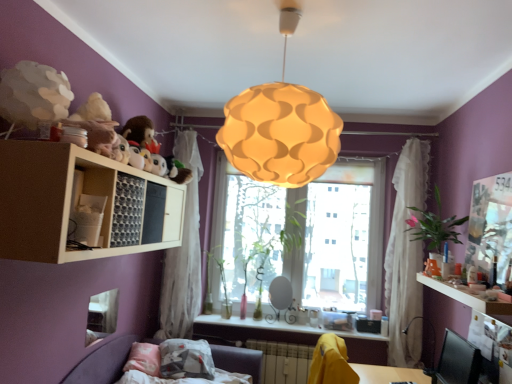
Measure the distance between green glass vase at window, the third plant when ordered from left to right, and camera.

The depth of green glass vase at window, the third plant when ordered from left to right, is 3.49 meters.

What do you see at coordinates (466, 297) in the screenshot? The height and width of the screenshot is (384, 512). I see `matte purple counter top at right, the 2th counter top when ordered from back to front` at bounding box center [466, 297].

Describe the element at coordinates (432, 344) in the screenshot. I see `metallic silver table lamp at lower right` at that location.

Describe the element at coordinates (331, 362) in the screenshot. The height and width of the screenshot is (384, 512). I see `yellow fabric swivel chair at lower center` at that location.

What do you see at coordinates (183, 253) in the screenshot? I see `white sheer curtain at left, placed as the 1th curtain when sorted from left to right` at bounding box center [183, 253].

The width and height of the screenshot is (512, 384). I want to click on matte orange lampshade at center, so click(281, 126).

Identify the location of green glass vase at window, which is counted as the second plant, starting from the right. This screenshot has width=512, height=384. (293, 240).

Could you measure the distance between white sheer curtain at right, placed as the 2th curtain when sorted from left to right, and yellow fabric swivel chair at lower center?

A distance of 3.47 feet exists between white sheer curtain at right, placed as the 2th curtain when sorted from left to right, and yellow fabric swivel chair at lower center.

Is white sheer curtain at right, placed as the 2th curtain when sorted from left to right, wider than yellow fabric swivel chair at lower center?

Incorrect, the width of white sheer curtain at right, placed as the 2th curtain when sorted from left to right, does not surpass that of yellow fabric swivel chair at lower center.

Is white sheer curtain at right, placed as the 2th curtain when sorted from left to right, located outside yellow fabric swivel chair at lower center?

white sheer curtain at right, placed as the 2th curtain when sorted from left to right, is positioned outside yellow fabric swivel chair at lower center.

At what (x,y) coordinates should I click in order to perform the action: click on the 1st curtain behind when counting from the yellow fabric swivel chair at lower center. Please return your answer as a coordinate pair (x, y). Looking at the image, I should click on (406, 256).

From the image's perspective, is green leafy plant at right, the fourth plant when ordered from back to front, under purple fabric couch at lower left?

Actually, green leafy plant at right, the fourth plant when ordered from back to front, appears above purple fabric couch at lower left in the image.

Could you tell me if green leafy plant at right, placed as the 4th plant when sorted from left to right, is turned towards purple fabric couch at lower left?

No, green leafy plant at right, placed as the 4th plant when sorted from left to right, is not facing towards purple fabric couch at lower left.

From a real-world perspective, which is physically below, green leafy plant at right, placed as the 1th plant when sorted from front to back, or purple fabric couch at lower left?

From a 3D spatial view, purple fabric couch at lower left is below.

Is point (431, 213) farther from camera compared to point (115, 369)?

Yes.

Is point (258, 141) positioned in front of point (433, 220)?

That is True.

Consider the image. From a real-world perspective, which is physically above, matte orange lampshade at center or green leafy plant at right, the 1th plant in the right-to-left sequence?

In real-world perspective, matte orange lampshade at center is above.

Is matte orange lampshade at center touching green leafy plant at right, the 1th plant in the right-to-left sequence?

No, matte orange lampshade at center is not touching green leafy plant at right, the 1th plant in the right-to-left sequence.

Considering the sizes of objects matte orange lampshade at center and green leafy plant at right, placed as the 4th plant when sorted from left to right, in the image provided, who is wider, matte orange lampshade at center or green leafy plant at right, placed as the 4th plant when sorted from left to right,?

Wider between the two is matte orange lampshade at center.

Is green glass vase at window, which is counted as the second plant, starting from the right, situated inside purple fabric couch at lower left or outside?

green glass vase at window, which is counted as the second plant, starting from the right, cannot be found inside purple fabric couch at lower left.

Based on the photo, from the image's perspective, between green glass vase at window, which is counted as the second plant, starting from the right, and purple fabric couch at lower left, who is located below?

purple fabric couch at lower left.

Is green glass vase at window, which is counted as the second plant, starting from the right, next to purple fabric couch at lower left?

No, green glass vase at window, which is counted as the second plant, starting from the right, is not beside purple fabric couch at lower left.

From a real-world perspective, which is physically below, matte white shelf at lower center, which is the second counter top from top to bottom, or yellow fabric swivel chair at lower center?

From a 3D spatial view, yellow fabric swivel chair at lower center is below.

Locate an element on the screen. The height and width of the screenshot is (384, 512). swivel chair on the right of matte white shelf at lower center, positioned as the 2th counter top in front-to-back order is located at coordinates (331, 362).

Is matte white shelf at lower center, positioned as the 2th counter top in front-to-back order, to the left or to the right of yellow fabric swivel chair at lower center in the image?

matte white shelf at lower center, positioned as the 2th counter top in front-to-back order, is positioned on yellow fabric swivel chair at lower center's left side.

Can you confirm if matte white shelf at lower center, the 1th counter top in the left-to-right sequence, is bigger than yellow fabric swivel chair at lower center?

No.

Does white sheer curtain at right, which is the 1th curtain from right to left, touch metallic silver table lamp at lower right?

No, white sheer curtain at right, which is the 1th curtain from right to left, is not with metallic silver table lamp at lower right.

Can metallic silver table lamp at lower right be found inside white sheer curtain at right, which is the 1th curtain from right to left?

Actually, metallic silver table lamp at lower right is outside white sheer curtain at right, which is the 1th curtain from right to left.

Consider the image. How different are the orientations of white sheer curtain at right, placed as the 2th curtain when sorted from left to right, and metallic silver table lamp at lower right in degrees?

The facing directions of white sheer curtain at right, placed as the 2th curtain when sorted from left to right, and metallic silver table lamp at lower right are 63.8 degrees apart.

Considering the positions of point (403, 310) and point (431, 365), is point (403, 310) closer or farther from the camera than point (431, 365)?

Clearly, point (403, 310) is more distant from the camera than point (431, 365).

Looking at the image, does yellow fabric swivel chair at lower center seem bigger or smaller compared to matte purple counter top at right, the 2th counter top when ordered from back to front?

Clearly, yellow fabric swivel chair at lower center is larger in size than matte purple counter top at right, the 2th counter top when ordered from back to front.

You are a GUI agent. You are given a task and a screenshot of the screen. Output one action in this format:
    pyautogui.click(x=<x>, y=<y>)
    Task: Click on the counter top located in front of the yellow fabric swivel chair at lower center
    This screenshot has height=384, width=512.
    Given the screenshot: What is the action you would take?
    pyautogui.click(x=466, y=297)

From the image's perspective, which is below, yellow fabric swivel chair at lower center or matte purple counter top at right, which ranks as the first counter top in front-to-back order?

yellow fabric swivel chair at lower center appears lower in the image.

Is yellow fabric swivel chair at lower center spatially inside matte purple counter top at right, the 2th counter top when ordered from back to front, or outside of it?

yellow fabric swivel chair at lower center is not enclosed by matte purple counter top at right, the 2th counter top when ordered from back to front.

Identify the location of curtain that is the 1st one when counting backward from the yellow fabric swivel chair at lower center. Image resolution: width=512 pixels, height=384 pixels. (406, 256).

Locate an element on the screen. plant that is the 4th object above the purple fabric couch at lower left (from a real-world perspective) is located at coordinates (434, 226).

Looking at the image, which one is located further to white sheer curtain at right, placed as the 2th curtain when sorted from left to right, white matte shelf at upper left or green glass vase at window, the third plant when ordered from left to right?

The object further to white sheer curtain at right, placed as the 2th curtain when sorted from left to right, is white matte shelf at upper left.

Considering their positions, is yellow fabric swivel chair at lower center positioned closer to white sheer curtain at right, placed as the 2th curtain when sorted from left to right, than matte white shelf at lower center, which ranks as the 2th counter top in right-to-left order?

matte white shelf at lower center, which ranks as the 2th counter top in right-to-left order, is closer to white sheer curtain at right, placed as the 2th curtain when sorted from left to right.

Estimate the real-world distances between objects in this image. Which object is further from purple fabric couch at lower left, yellow fabric swivel chair at lower center or green glossy plant at window, which appears as the fourth plant when viewed from the right?

Among the two, yellow fabric swivel chair at lower center is located further to purple fabric couch at lower left.

Estimate the real-world distances between objects in this image. Which object is closer to matte orange lampshade at center, yellow fabric swivel chair at lower center or white matte shelf at upper left?

The object closer to matte orange lampshade at center is white matte shelf at upper left.

Based on their spatial positions, is green leafy plant at right, placed as the 1th plant when sorted from front to back, or fluffy plush toys at upper left closer to yellow fabric swivel chair at lower center?

Among the two, green leafy plant at right, placed as the 1th plant when sorted from front to back, is located nearer to yellow fabric swivel chair at lower center.

Which object lies nearer to the anchor point matte purple counter top at right, which is the second counter top from left to right, translucent glass window at center or matte white shelf at lower center, the 1th counter top in the left-to-right sequence?

Among the two, matte white shelf at lower center, the 1th counter top in the left-to-right sequence, is located nearer to matte purple counter top at right, which is the second counter top from left to right.

Which object lies further to the anchor point green glass vase at window, the second plant in the front-to-back sequence, translucent glass window at center or green leafy plant at right, the fourth plant when ordered from back to front?

Among the two, green leafy plant at right, the fourth plant when ordered from back to front, is located further to green glass vase at window, the second plant in the front-to-back sequence.

Based on their spatial positions, is white matte shelf at upper left or yellow fabric swivel chair at lower center closer to green glossy plant at window, positioned as the second plant in back-to-front order?

yellow fabric swivel chair at lower center is closer to green glossy plant at window, positioned as the second plant in back-to-front order.

You are a GUI agent. You are given a task and a screenshot of the screen. Output one action in this format:
    pyautogui.click(x=<x>, y=<y>)
    Task: Click on the toy between matte orange lampshade at center and green glossy plant at window, which appears as the fourth plant when viewed from the right, in the front-back direction
    
    Given the screenshot: What is the action you would take?
    pyautogui.click(x=96, y=124)

Find the location of `counter top between green matte plant at window, marked as the 4th plant in a front-to-back arrangement, and metallic silver table lamp at lower right, in the horizontal direction`. counter top between green matte plant at window, marked as the 4th plant in a front-to-back arrangement, and metallic silver table lamp at lower right, in the horizontal direction is located at coordinates (258, 324).

Find the location of a particular element. This screenshot has height=384, width=512. table lamp between purple fabric couch at lower left and matte purple counter top at right, which is the second counter top from left to right, from left to right is located at coordinates coord(432,344).

You are a GUI agent. You are given a task and a screenshot of the screen. Output one action in this format:
    pyautogui.click(x=<x>, y=<y>)
    Task: Click on the couch situated between white sheer curtain at left, the second curtain viewed from the right, and white sheer curtain at right, which is the 1th curtain from right to left, from left to right
    This screenshot has width=512, height=384.
    Given the screenshot: What is the action you would take?
    pyautogui.click(x=105, y=362)